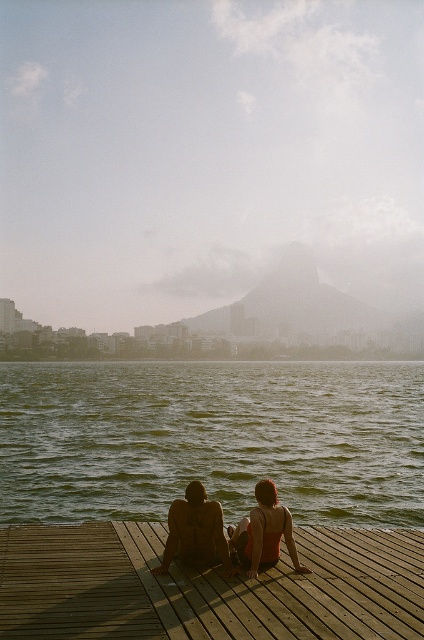
You are standing on the dock and want to walk towards the wooden at lower center. Which direction should you move relative to the green water at center?

The green water at center is further to the viewer than wooden at lower center, so you should move away from the green water at center to reach the wooden at lower center.